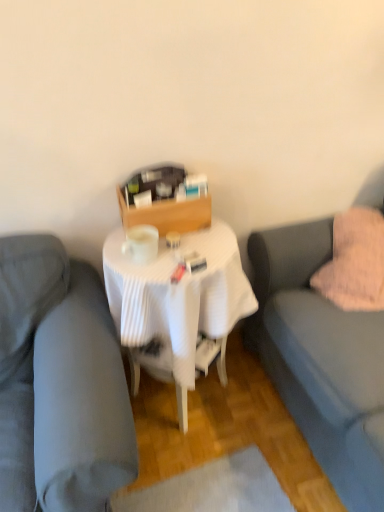
Measure the distance between matte gray couch at center, which appears as the second studio couch when viewed from the right, and camera.

A distance of 94.93 centimeters exists between matte gray couch at center, which appears as the second studio couch when viewed from the right, and camera.

Locate an element on the screen. This screenshot has height=512, width=384. matte gray couch at center, the first studio couch positioned from the left is located at coordinates (59, 384).

Who is bigger, soft gray fabric couch at right, arranged as the 1th studio couch when viewed from the right, or pink fluffy pillow at right?

Bigger between the two is soft gray fabric couch at right, arranged as the 1th studio couch when viewed from the right.

From the pink fluffy pillow at right, count 1st studio couchs forward and point to it. Please provide its 2D coordinates.

[(321, 359)]

Considering the positions of objects soft gray fabric couch at right, arranged as the 1th studio couch when viewed from the right, and pink fluffy pillow at right in the image provided, who is more to the right, soft gray fabric couch at right, arranged as the 1th studio couch when viewed from the right, or pink fluffy pillow at right?

soft gray fabric couch at right, arranged as the 1th studio couch when viewed from the right.

Are matte gray couch at center, the first studio couch positioned from the left, and pink fluffy pillow at right beside each other?

They are not placed beside each other.

In terms of width, does matte gray couch at center, which appears as the second studio couch when viewed from the right, look wider or thinner when compared to pink fluffy pillow at right?

Clearly, matte gray couch at center, which appears as the second studio couch when viewed from the right, has more width compared to pink fluffy pillow at right.

From the image's perspective, who appears lower, matte gray couch at center, which appears as the second studio couch when viewed from the right, or pink fluffy pillow at right?

From the image's view, matte gray couch at center, which appears as the second studio couch when viewed from the right, is below.

In terms of height, does matte gray couch at center, the first studio couch positioned from the left, look taller or shorter compared to pink fluffy pillow at right?

Considering their sizes, matte gray couch at center, the first studio couch positioned from the left, has more height than pink fluffy pillow at right.

Can we say pink fluffy pillow at right lies outside soft gray fabric couch at right, arranged as the 1th studio couch when viewed from the right?

Actually, pink fluffy pillow at right is within soft gray fabric couch at right, arranged as the 1th studio couch when viewed from the right.

From the image's perspective, is pink fluffy pillow at right located above or below soft gray fabric couch at right, arranged as the 1th studio couch when viewed from the right?

pink fluffy pillow at right is above soft gray fabric couch at right, arranged as the 1th studio couch when viewed from the right.

What's the angular difference between pink fluffy pillow at right and matte gray couch at center, the first studio couch positioned from the left,'s facing directions?

pink fluffy pillow at right and matte gray couch at center, the first studio couch positioned from the left, are facing 0.267 degrees away from each other.

Which object is positioned more to the left, pink fluffy pillow at right or matte gray couch at center, which appears as the second studio couch when viewed from the right?

matte gray couch at center, which appears as the second studio couch when viewed from the right, is more to the left.

Looking at their sizes, would you say pink fluffy pillow at right is wider or thinner than matte gray couch at center, the first studio couch positioned from the left?

In the image, pink fluffy pillow at right appears to be more narrow than matte gray couch at center, the first studio couch positioned from the left.

From a real-world perspective, is pink fluffy pillow at right positioned under matte gray couch at center, which appears as the second studio couch when viewed from the right, based on gravity?

No, from a real-world perspective, pink fluffy pillow at right is not below matte gray couch at center, which appears as the second studio couch when viewed from the right.

Is matte gray couch at center, which appears as the second studio couch when viewed from the right, not close to white pleated tablecloth at center?

Actually, matte gray couch at center, which appears as the second studio couch when viewed from the right, and white pleated tablecloth at center are a little close together.

What's the angular difference between matte gray couch at center, which appears as the second studio couch when viewed from the right, and white pleated tablecloth at center's facing directions?

The angular difference between matte gray couch at center, which appears as the second studio couch when viewed from the right, and white pleated tablecloth at center is 0.998 degrees.

Considering the points (100, 359) and (146, 304), which point is in front, point (100, 359) or point (146, 304)?

The point (100, 359) is more forward.

Between matte gray couch at center, the first studio couch positioned from the left, and white pleated tablecloth at center, which one is positioned behind?

white pleated tablecloth at center is behind.

Is white pleated tablecloth at center outside of soft gray fabric couch at right, the second studio couch in the left-to-right sequence?

Indeed, white pleated tablecloth at center is completely outside soft gray fabric couch at right, the second studio couch in the left-to-right sequence.

Does point (194, 247) appear closer or farther from the camera than point (252, 249)?

Point (194, 247) is closer to the camera than point (252, 249).

Is white pleated tablecloth at center aimed at soft gray fabric couch at right, the second studio couch in the left-to-right sequence?

No, white pleated tablecloth at center is not turned towards soft gray fabric couch at right, the second studio couch in the left-to-right sequence.

Is white pleated tablecloth at center taller or shorter than soft gray fabric couch at right, arranged as the 1th studio couch when viewed from the right?

Clearly, white pleated tablecloth at center is shorter compared to soft gray fabric couch at right, arranged as the 1th studio couch when viewed from the right.

Considering the sizes of objects matte gray couch at center, the first studio couch positioned from the left, and soft gray fabric couch at right, the second studio couch in the left-to-right sequence, in the image provided, who is smaller, matte gray couch at center, the first studio couch positioned from the left, or soft gray fabric couch at right, the second studio couch in the left-to-right sequence,?

Smaller between the two is matte gray couch at center, the first studio couch positioned from the left.

Looking at their sizes, would you say matte gray couch at center, the first studio couch positioned from the left, is wider or thinner than soft gray fabric couch at right, the second studio couch in the left-to-right sequence?

In the image, matte gray couch at center, the first studio couch positioned from the left, appears to be wider than soft gray fabric couch at right, the second studio couch in the left-to-right sequence.

In the scene shown: From the image's perspective, is matte gray couch at center, the first studio couch positioned from the left, located beneath soft gray fabric couch at right, the second studio couch in the left-to-right sequence?

Indeed, from the image's perspective, matte gray couch at center, the first studio couch positioned from the left, is shown beneath soft gray fabric couch at right, the second studio couch in the left-to-right sequence.

Image resolution: width=384 pixels, height=512 pixels. I want to click on throw pillow above the soft gray fabric couch at right, arranged as the 1th studio couch when viewed from the right (from the image's perspective), so click(x=355, y=262).

Where is `throw pillow behind the matte gray couch at center, the first studio couch positioned from the left`? The width and height of the screenshot is (384, 512). throw pillow behind the matte gray couch at center, the first studio couch positioned from the left is located at coordinates (355, 262).

Considering their positions, is matte gray couch at center, which appears as the second studio couch when viewed from the right, positioned closer to pink fluffy pillow at right than soft gray fabric couch at right, the second studio couch in the left-to-right sequence?

soft gray fabric couch at right, the second studio couch in the left-to-right sequence, lies closer to pink fluffy pillow at right than the other object.

Which object lies nearer to the anchor point white pleated tablecloth at center, matte gray couch at center, which appears as the second studio couch when viewed from the right, or pink fluffy pillow at right?

matte gray couch at center, which appears as the second studio couch when viewed from the right, lies closer to white pleated tablecloth at center than the other object.

Considering their positions, is soft gray fabric couch at right, the second studio couch in the left-to-right sequence, positioned further to white pleated tablecloth at center than matte gray couch at center, which appears as the second studio couch when viewed from the right?

Among the two, soft gray fabric couch at right, the second studio couch in the left-to-right sequence, is located further to white pleated tablecloth at center.

When comparing their distances from soft gray fabric couch at right, arranged as the 1th studio couch when viewed from the right, does white pleated tablecloth at center or matte gray couch at center, which appears as the second studio couch when viewed from the right, seem closer?

white pleated tablecloth at center.

Which object lies further to the anchor point white pleated tablecloth at center, pink fluffy pillow at right or soft gray fabric couch at right, arranged as the 1th studio couch when viewed from the right?

pink fluffy pillow at right is further to white pleated tablecloth at center.

In the scene shown: Based on their spatial positions, is pink fluffy pillow at right or matte gray couch at center, the first studio couch positioned from the left, further from soft gray fabric couch at right, arranged as the 1th studio couch when viewed from the right?

matte gray couch at center, the first studio couch positioned from the left, is further to soft gray fabric couch at right, arranged as the 1th studio couch when viewed from the right.

From the picture: Looking at the image, which one is located closer to matte gray couch at center, which appears as the second studio couch when viewed from the right, white pleated tablecloth at center or soft gray fabric couch at right, arranged as the 1th studio couch when viewed from the right?

Among the two, white pleated tablecloth at center is located nearer to matte gray couch at center, which appears as the second studio couch when viewed from the right.

Estimate the real-world distances between objects in this image. Which object is further from matte gray couch at center, the first studio couch positioned from the left, white pleated tablecloth at center or pink fluffy pillow at right?

pink fluffy pillow at right is positioned further to the anchor matte gray couch at center, the first studio couch positioned from the left.

Find the location of a particular element. throw pillow between matte gray couch at center, the first studio couch positioned from the left, and soft gray fabric couch at right, arranged as the 1th studio couch when viewed from the right, from left to right is located at coordinates (355, 262).

At what (x,y) coordinates should I click in order to perform the action: click on throw pillow located between white pleated tablecloth at center and soft gray fabric couch at right, the second studio couch in the left-to-right sequence, in the left-right direction. Please return your answer as a coordinate pair (x, y). Looking at the image, I should click on (355, 262).

I want to click on table between matte gray couch at center, the first studio couch positioned from the left, and pink fluffy pillow at right from left to right, so click(x=177, y=304).

The image size is (384, 512). Identify the location of table between matte gray couch at center, which appears as the second studio couch when viewed from the right, and soft gray fabric couch at right, the second studio couch in the left-to-right sequence. (177, 304).